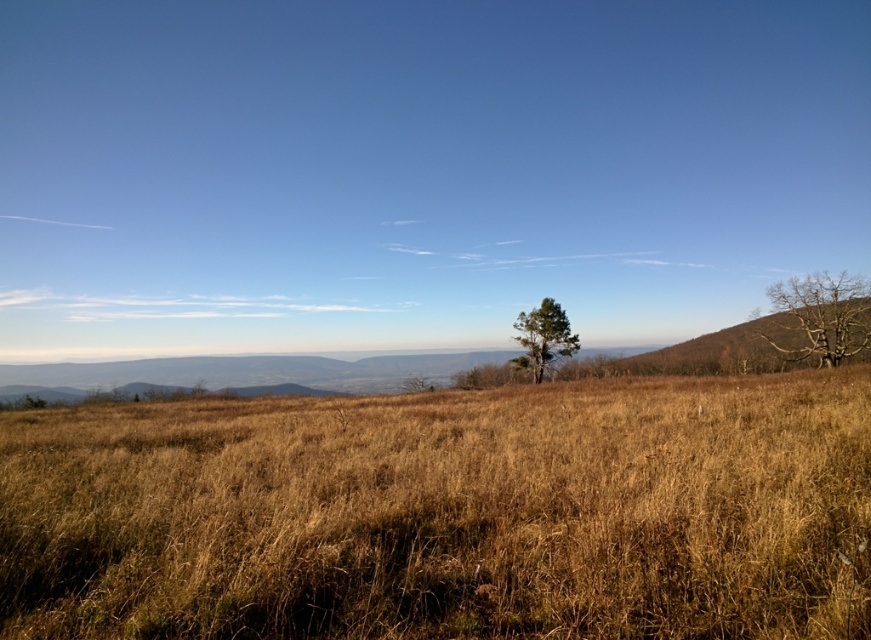
Which is more to the left, dry grass at center or bare wood tree at right?

From the viewer's perspective, dry grass at center appears more on the left side.

What do you see at coordinates (447, 513) in the screenshot?
I see `dry grass at center` at bounding box center [447, 513].

Does point (643, 474) come farther from viewer compared to point (821, 323)?

No.

This screenshot has width=871, height=640. In order to click on dry grass at center in this screenshot , I will do `click(447, 513)`.

Who is positioned more to the right, dry grass at center or green matte tree at center?

green matte tree at center

Locate an element on the screen. The height and width of the screenshot is (640, 871). dry grass at center is located at coordinates (447, 513).

Is bare wood tree at right bigger than green matte tree at center?

Yes.

Can you confirm if bare wood tree at right is wider than green matte tree at center?

Yes, bare wood tree at right is wider than green matte tree at center.

Is point (799, 312) positioned after point (538, 381)?

No, it is not.

Where is `bare wood tree at right`? bare wood tree at right is located at coordinates (822, 316).